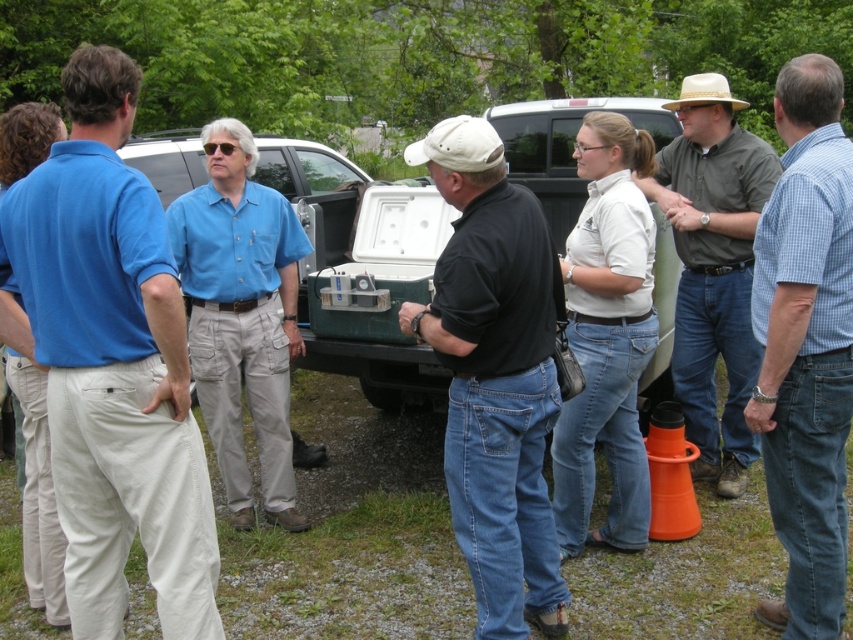
Consider the image. You are planning to load a long piece of equipment that requires a minimum width of 2 meters. Based on the scene, which truck between the green matte truck at center and the matte blue truck at center would be more suitable for this task?

The green matte truck at center has a greater width than the matte blue truck at center, making it more suitable for the long piece of equipment requiring a minimum width of 2 meters.

You are a photographer trying to capture a group photo of the blue checkered shirt at right and the matte blue truck at center. If you want to ensure both are in focus, which object should you position closer to the camera?

The blue checkered shirt at right is thinner than the matte blue truck at center, so positioning the blue checkered shirt at right closer to the camera would help ensure both are in focus.

You are planning to load a large equipment box that requires a truck with a tailgate area of at least 2 meters in length. Based on the scene, which truck between the green matte truck at center and the matte blue truck at center would be more suitable for this task?

The matte blue truck at center is larger than the green matte truck at center, so it would be more suitable for loading the large equipment box requiring a tailgate area of at least 2 meters in length.